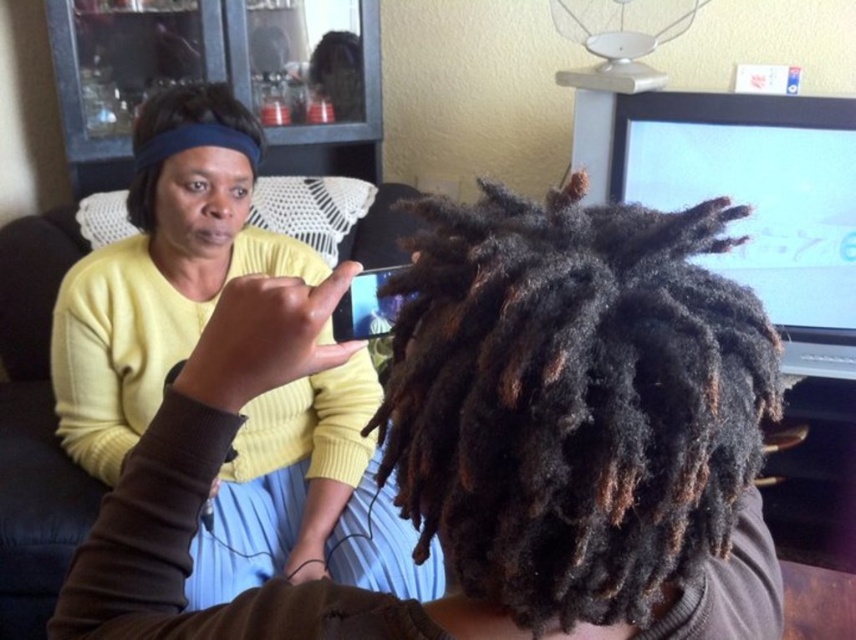
Measure the distance between black matte hair at upper left and matte black phone at center.

black matte hair at upper left is 17.65 inches from matte black phone at center.

What do you see at coordinates (192, 112) in the screenshot? I see `black matte hair at upper left` at bounding box center [192, 112].

Where is `black matte hair at upper left`? This screenshot has width=856, height=640. black matte hair at upper left is located at coordinates (192, 112).

Who is positioned more to the right, dark curly hair at center or matte yellow sweater at upper left?

From the viewer's perspective, dark curly hair at center appears more on the right side.

Is point (723, 470) more distant than point (304, 461)?

No.

Where is `dark curly hair at center`? dark curly hair at center is located at coordinates (580, 412).

Can you confirm if dark curly hair at center is positioned below matte black phone at center?

Correct, dark curly hair at center is located below matte black phone at center.

Between dark curly hair at center and matte black phone at center, which one is positioned higher?

matte black phone at center

Locate an element on the screen. The width and height of the screenshot is (856, 640). dark curly hair at center is located at coordinates (580, 412).